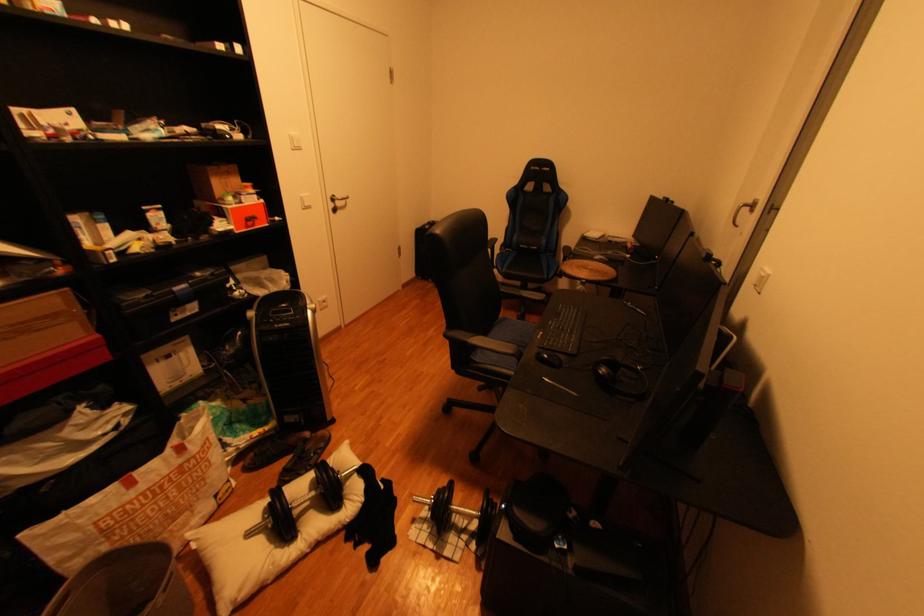
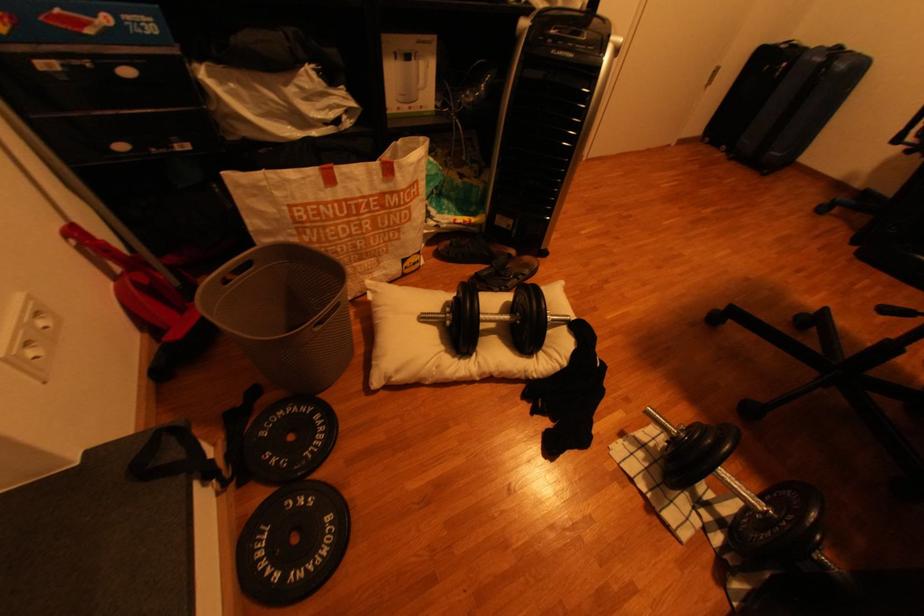
The images are taken continuously from a first-person perspective. In which direction is your viewpoint rotating?

The camera's rotation is toward left-down.